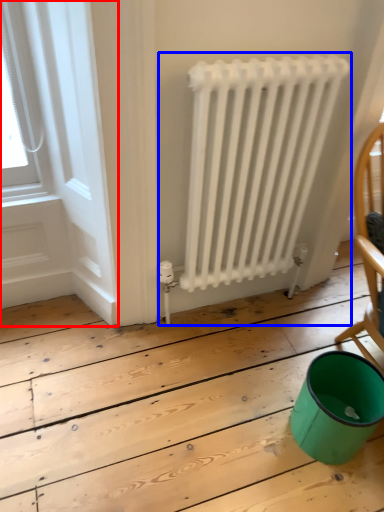
Question: Which point is closer to the camera, window frame (highlighted by a red box) or radiator (highlighted by a blue box)?

Choices:
 (A) window frame
 (B) radiator

Answer: (A)